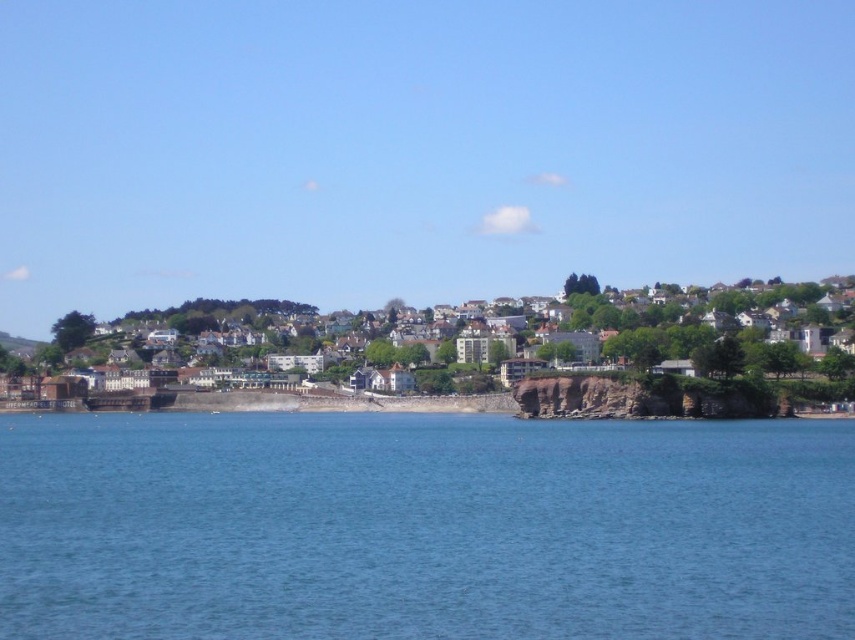
You are standing at the point marked as point (423, 528) in the image. What is the color of the area you are currently standing on?

The point (423, 528) indicates blue water at lower center, so the area you are standing on is blue water.

You are a photographer standing on the beach and want to capture both the blue water at lower center and the white textured houses at center in a single shot. Which object should you position closer to the left side of your camera frame?

The blue water at lower center should be positioned closer to the left side of your camera frame because it is already on the left side of the white textured houses at center in the scene.

You are a photographer planning to capture the coastal scene. You want to ensure that the blue water at lower center and the white textured houses at center are both visible in the frame. Based on their spatial relationship, which object will occupy a larger portion of the photo?

The white textured houses at center occupy more space than the blue water at lower center, so the white textured houses at center will take up a larger portion of the photo.